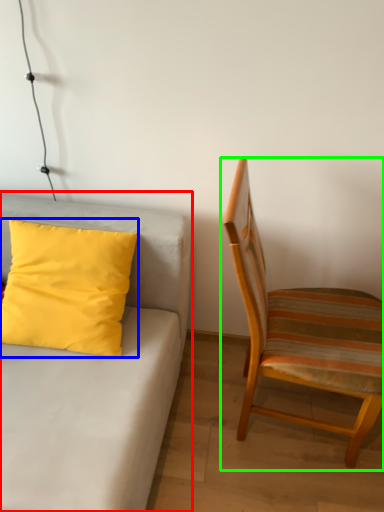
Question: Estimate the real-world distances between objects in this image. Which object is closer to studio couch (highlighted by a red box), pillow (highlighted by a blue box) or chair (highlighted by a green box)?

Choices:
 (A) pillow
 (B) chair

Answer: (A)